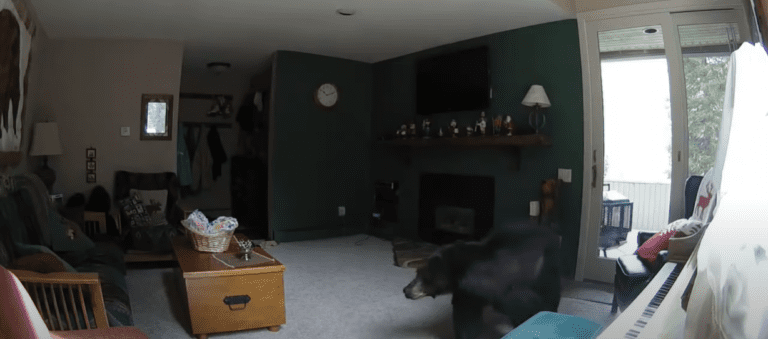
The image size is (768, 339). Identify the location of clock. (323, 99).